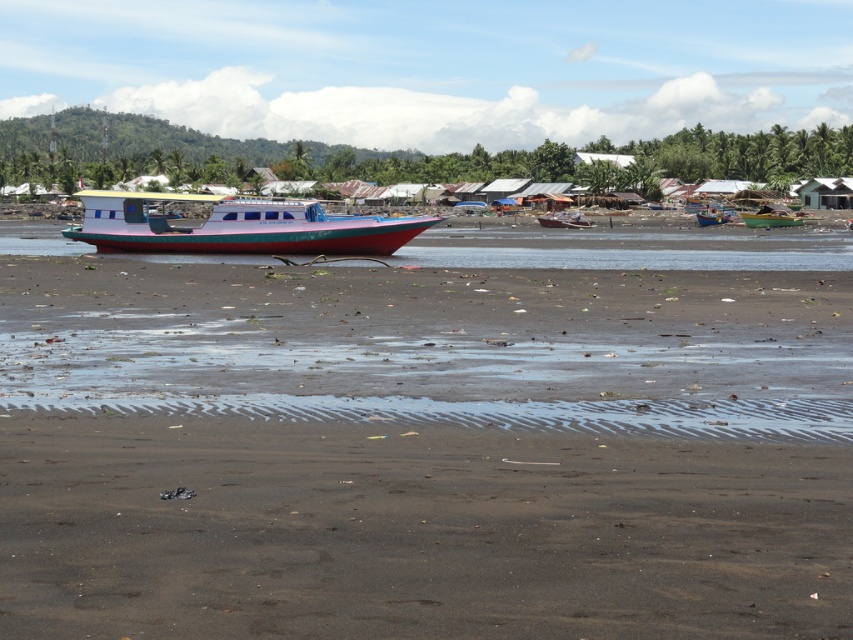
Question: Can you confirm if dark sand at lower center is positioned to the right of matte pink plastic boat at center?

Choices:
 (A) no
 (B) yes

Answer: (B)

Question: Which point appears closest to the camera in this image?

Choices:
 (A) (576, 220)
 (B) (569, 595)
 (C) (705, 216)
 (D) (784, 225)

Answer: (B)

Question: Which object appears farthest from the camera in this image?

Choices:
 (A) dark sand at lower center
 (B) metallic blue boat at center
 (C) matte pink plastic boat at center
 (D) blue plastic boat at center

Answer: (D)

Question: Is matte pink plastic boat at center to the left of blue plastic boat at center from the viewer's perspective?

Choices:
 (A) yes
 (B) no

Answer: (A)

Question: Which of the following is the closest to the observer?

Choices:
 (A) (280, 243)
 (B) (698, 214)

Answer: (A)

Question: Is dark sand at lower center to the left of metallic blue boat at center from the viewer's perspective?

Choices:
 (A) yes
 (B) no

Answer: (A)